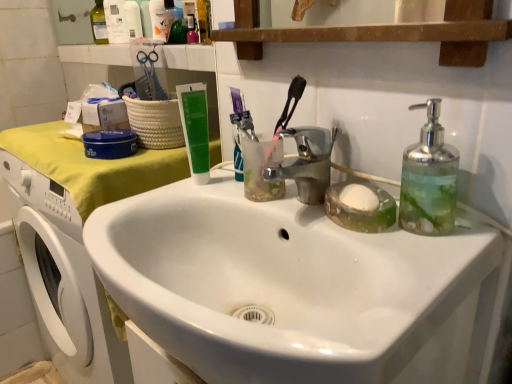
This screenshot has height=384, width=512. I want to click on vacant area situated to the left side of clear glass soap dispenser at right, so click(x=355, y=237).